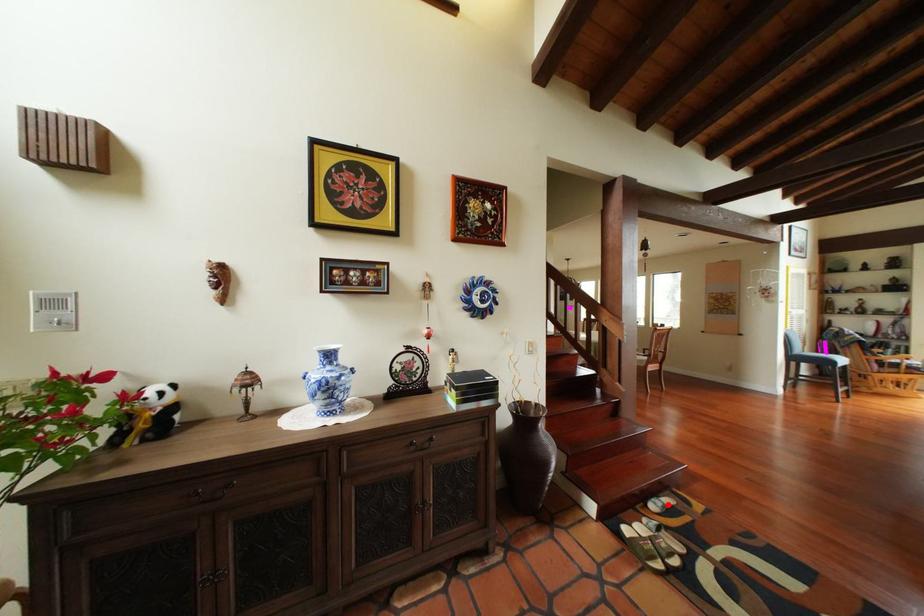
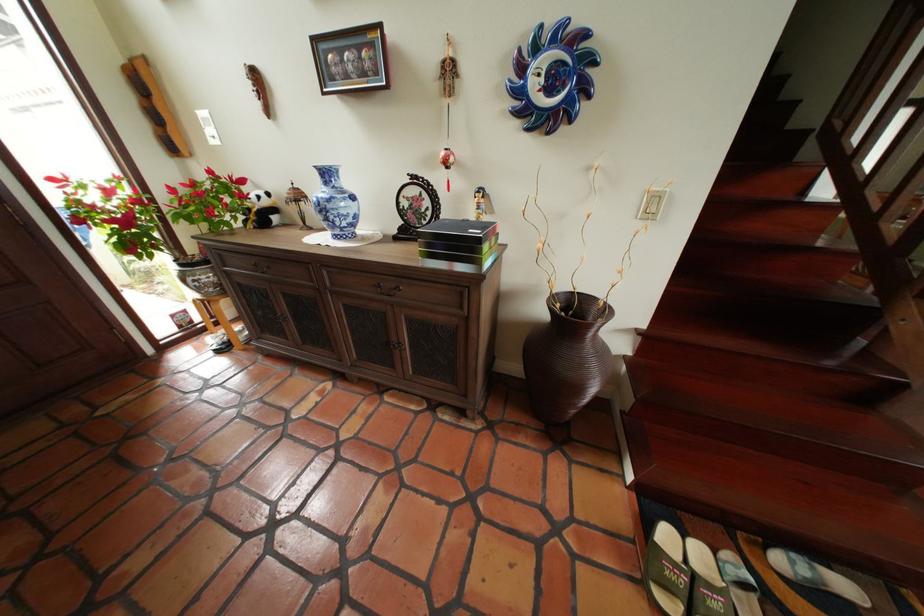
Question: A red point is marked in image1. In image2, is the corresponding 3D point closer to the camera or farther? Reply with the corresponding letter.

Choices:
 (A) The corresponding 3D point is closer.
 (B) The corresponding 3D point is farther.

Answer: (A)